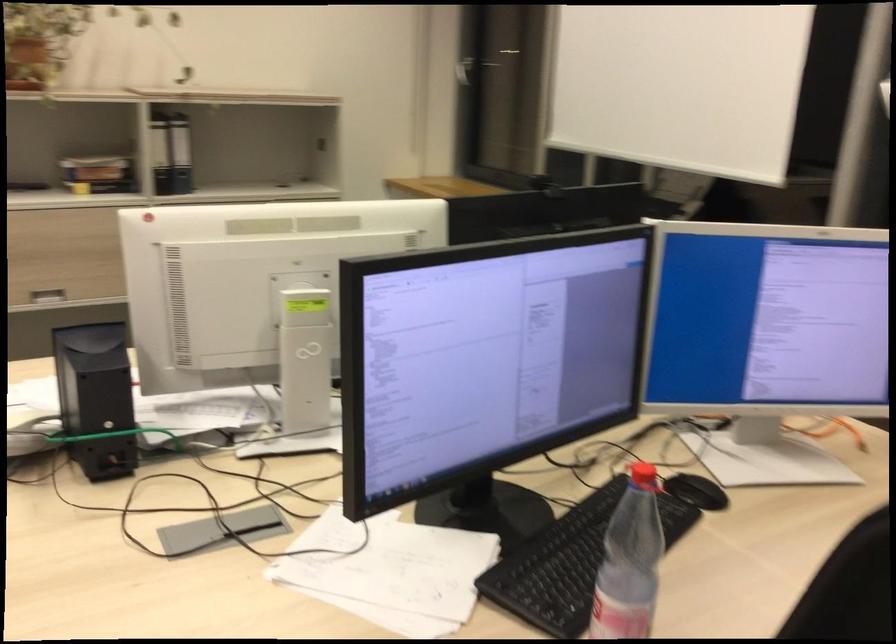
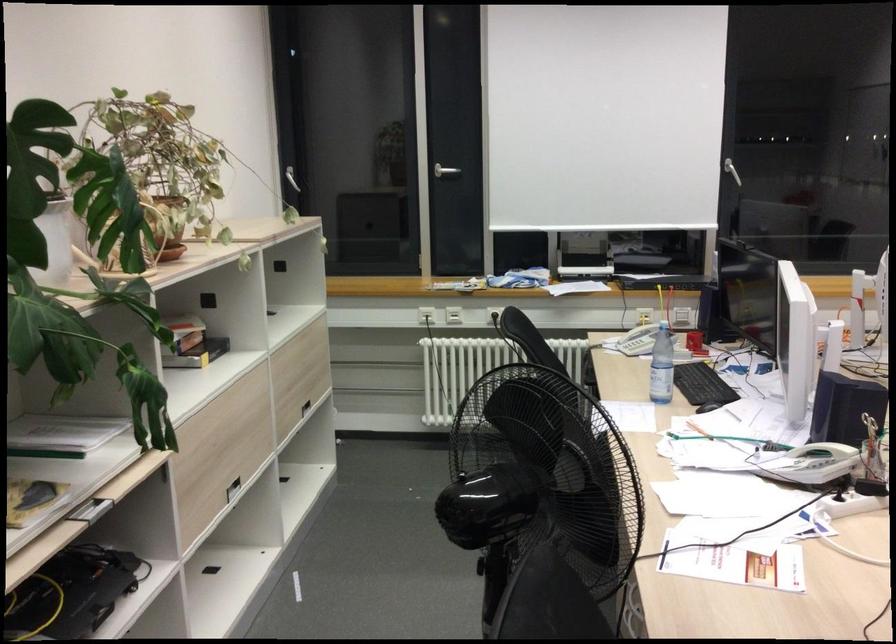
The point at (x=100, y=171) is marked in the first image. Where is the corresponding point in the second image?

(192, 343)